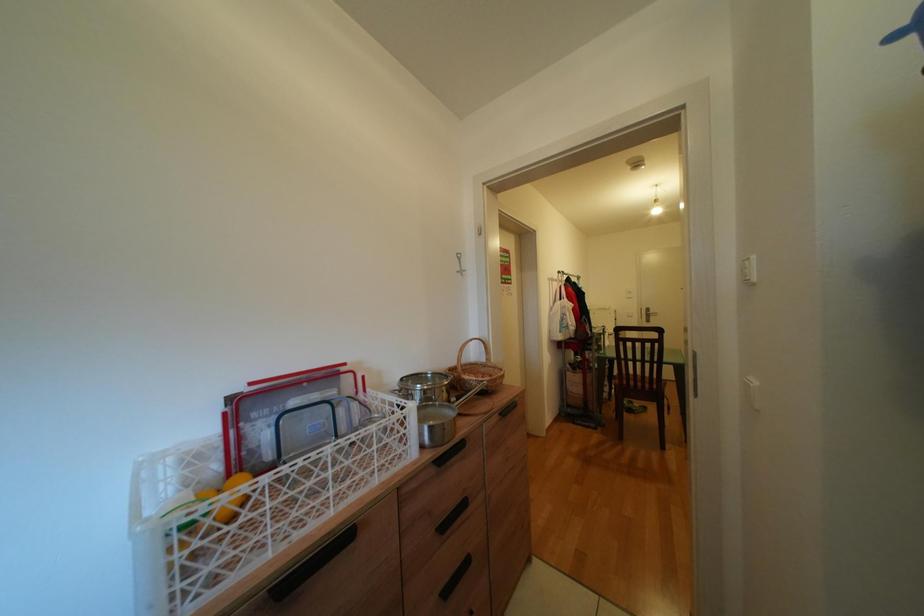
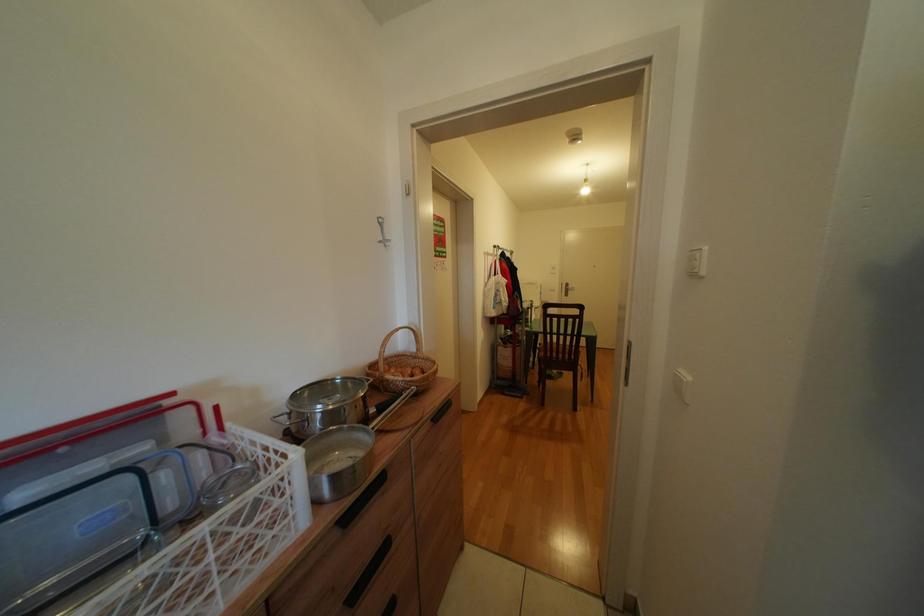
Question: The camera is either moving clockwise (left) or counter-clockwise (right) around the object. The first image is from the beginning of the video and the second image is from the end. Is the camera moving left or right when shooting the video?

Choices:
 (A) Left
 (B) Right

Answer: (A)